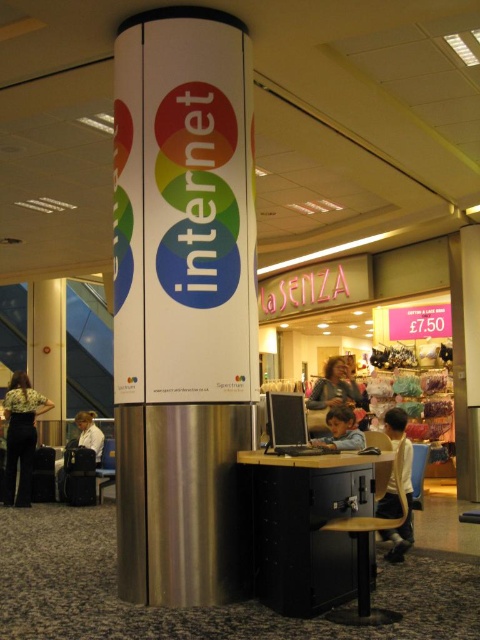
Between black metal cabinet at lower center and light yellow shirt at center, which one is positioned lower?

light yellow shirt at center is below.

Does black metal cabinet at lower center appear over light yellow shirt at center?

Yes, black metal cabinet at lower center is above light yellow shirt at center.

Is point (358, 468) positioned behind point (408, 465)?

No, (358, 468) is closer to viewer.

The image size is (480, 640). I want to click on black metal cabinet at lower center, so click(311, 525).

Between point (271, 481) and point (348, 444), which one is positioned behind?

The point (348, 444) is behind.

Measure the distance between black metal cabinet at lower center and camera.

black metal cabinet at lower center and camera are 3.38 meters apart.

Locate an element on the screen. Image resolution: width=480 pixels, height=640 pixels. black metal cabinet at lower center is located at coordinates (311, 525).

Does black glossy monitor at center have a greater width compared to light blue shirt at lower left?

No, black glossy monitor at center is not wider than light blue shirt at lower left.

Can you confirm if black glossy monitor at center is positioned below light blue shirt at lower left?

Incorrect, black glossy monitor at center is not positioned below light blue shirt at lower left.

Identify the location of black glossy monitor at center. Image resolution: width=480 pixels, height=640 pixels. (287, 424).